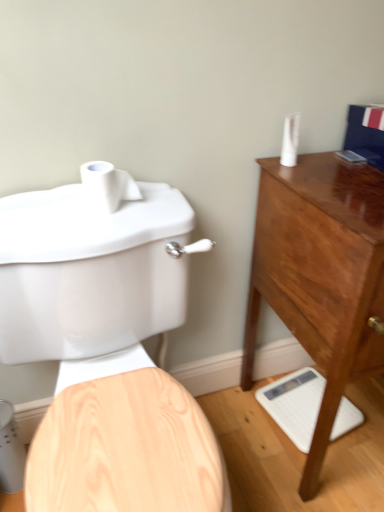
Locate an element on the screen. The width and height of the screenshot is (384, 512). vacant space in front of white matte toilet paper at upper left is located at coordinates (105, 220).